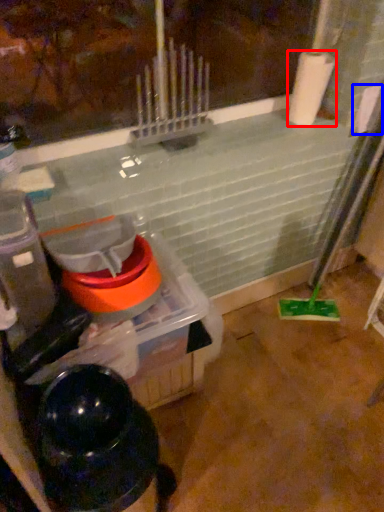
Question: Which object is further to the camera taking this photo, paper towel (highlighted by a red box) or toilet paper (highlighted by a blue box)?

Choices:
 (A) paper towel
 (B) toilet paper

Answer: (B)